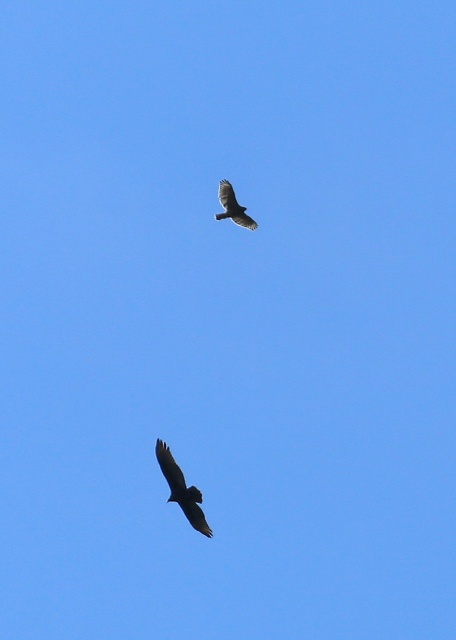
Does point (167, 500) lie behind point (233, 200)?

No, it is not.

Locate an element on the screen. The width and height of the screenshot is (456, 640). dark brown feathers at lower center is located at coordinates (181, 490).